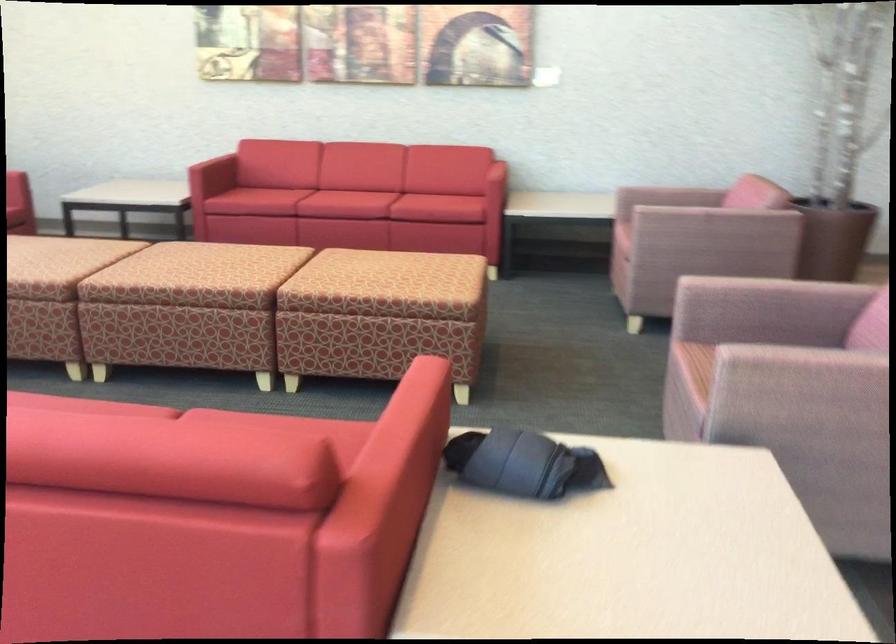
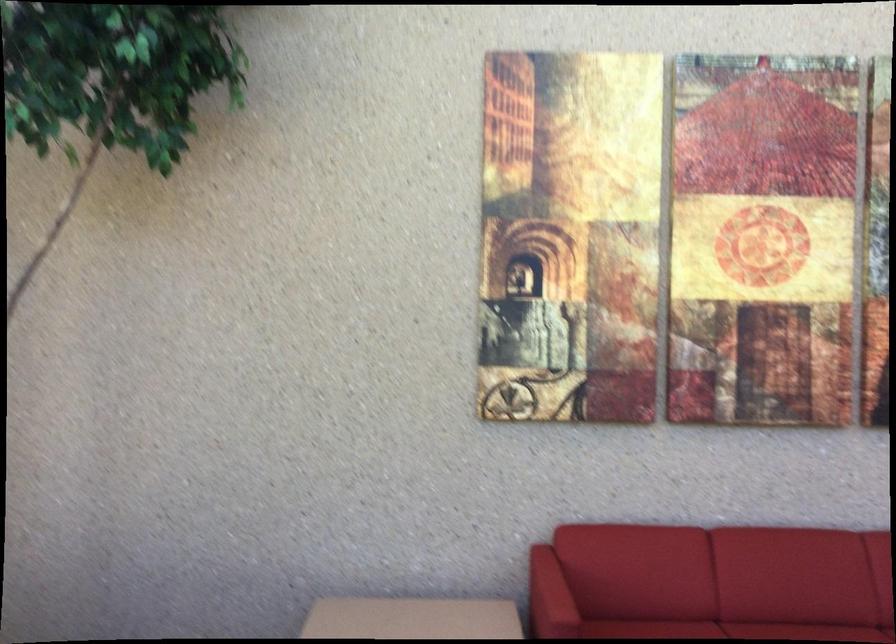
In the second image, find the point that corresponds to [312,172] in the first image.

(727, 630)